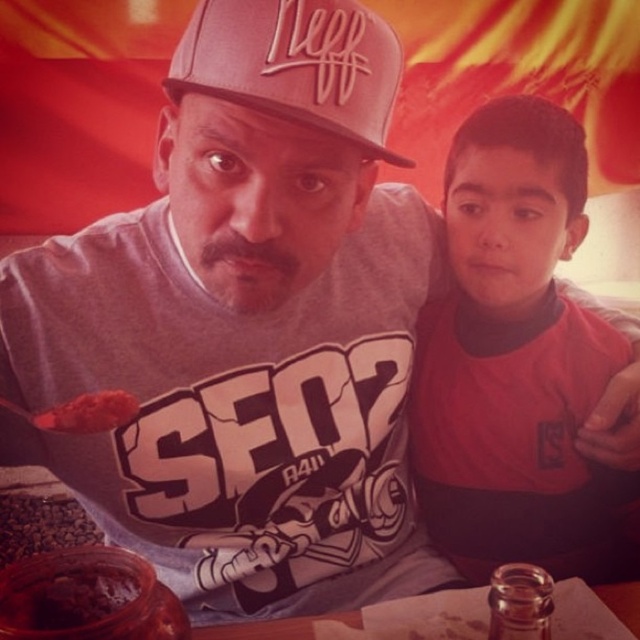
Consider the image. You are a barista at a coffee shop and need to place an order for a customer who wants a drink with the brown matte coffee beans at lower left. The customer also mentioned they want their drink near the matte pink baseball cap at center. Can you confirm if the coffee beans are below the baseball cap?

The matte pink baseball cap at center is located above the brown matte coffee beans at lower left, so yes, the coffee beans are below the baseball cap.

You are a photographer setting up a shoot at this dining table. You need to ensure that the matte red shirt at center and the brown matte coffee beans at lower left are both visible in the frame. Considering their sizes, which object should you position closer to the camera to maintain their visibility?

The matte red shirt at center is wider than the brown matte coffee beans at lower left. To maintain visibility, position the matte red shirt at center closer to the camera since its larger size might require more focus to ensure it doesn

You are an AI analyzing the spatial arrangement of clothing items in the image. The scene shows two people sitting at a table. Where is the matte red shirt at center located in terms of its 2D coordinates?

The matte red shirt at center is located at the 2D coordinates point (516,362).